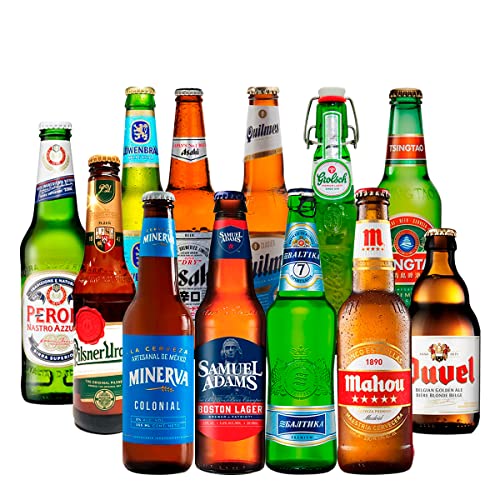
At what (x,y) coordinates should I click in order to perform the action: click on green bottle. Please return your answer as a coordinate pair (x, y). The image size is (500, 500). Looking at the image, I should click on (297, 344), (337, 216), (414, 182), (129, 177), (47, 225).